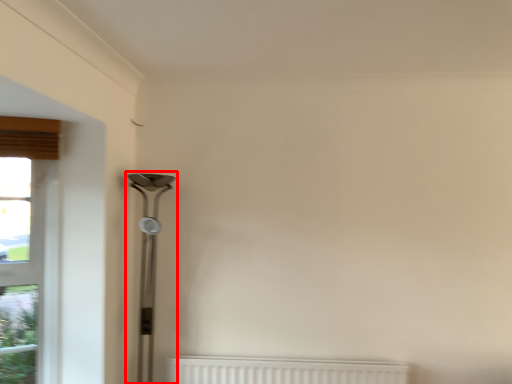
Question: From the image's perspective, what is the correct spatial positioning of table lamp (annotated by the red box) in reference to window?

Choices:
 (A) below
 (B) above

Answer: (B)